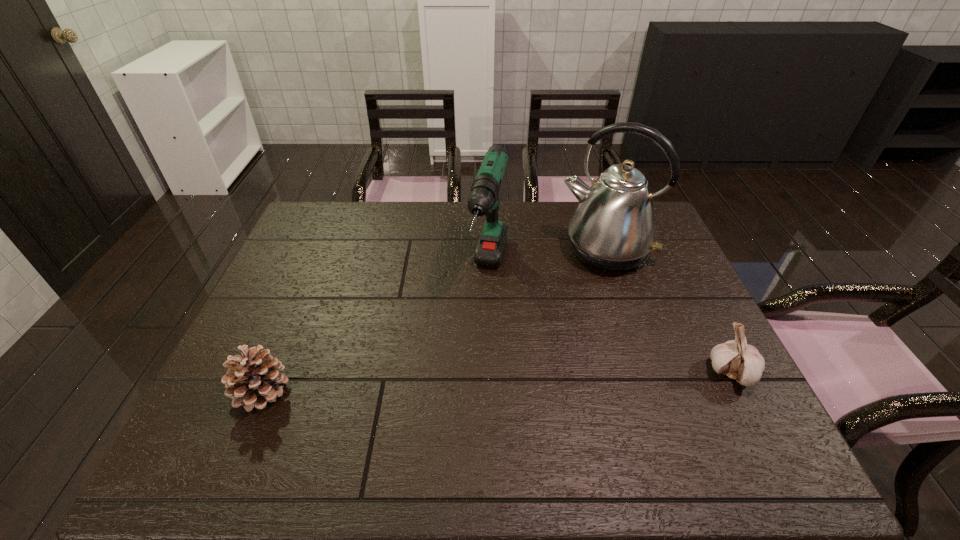
The width and height of the screenshot is (960, 540). Find the location of `free space located from the spout of the tallest object`. free space located from the spout of the tallest object is located at coordinates (556, 346).

This screenshot has height=540, width=960. Find the location of `vacant space located 0.260m from the spout of the tallest object`. vacant space located 0.260m from the spout of the tallest object is located at coordinates (561, 335).

Find the location of a particular element. This screenshot has height=540, width=960. vacant space located 0.390m from the spout of the tallest object is located at coordinates (542, 372).

Find the location of a particular element. The image size is (960, 540). drill that is at the far edge is located at coordinates tap(483, 199).

Locate an element on the screen. This screenshot has width=960, height=540. kettle present at the far edge is located at coordinates pos(613,229).

Locate an element on the screen. The image size is (960, 540). pinecone located in the near edge section of the desktop is located at coordinates (253, 380).

The width and height of the screenshot is (960, 540). I want to click on garlic present at the near edge, so click(x=736, y=359).

Where is `object present at the left edge`? object present at the left edge is located at coordinates (253, 380).

You are a GUI agent. You are given a task and a screenshot of the screen. Output one action in this format:
    pyautogui.click(x=<x>, y=<y>)
    Task: Click on the garlic that is positioned at the right edge
    The image size is (960, 540).
    Given the screenshot: What is the action you would take?
    pyautogui.click(x=736, y=359)

Where is `kettle located in the right edge section of the desktop`? The image size is (960, 540). kettle located in the right edge section of the desktop is located at coordinates (613, 229).